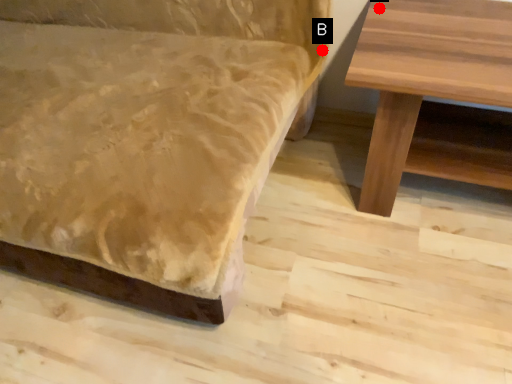
Question: Two points are circled on the image, labeled by A and B beside each circle. Which of the following is the closest to the observer?

Choices:
 (A) A is closer
 (B) B is closer

Answer: (A)